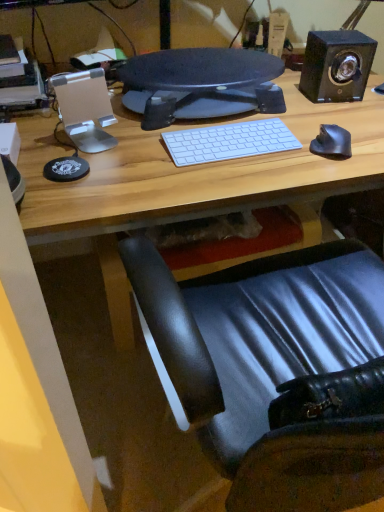
You are a GUI agent. You are given a task and a screenshot of the screen. Output one action in this format:
    pyautogui.click(x=<x>, y=<y>)
    Task: Click on the free point above white matte keyboard at center (from a real-world perspective)
    The width and height of the screenshot is (384, 512).
    Given the screenshot: What is the action you would take?
    pyautogui.click(x=233, y=135)